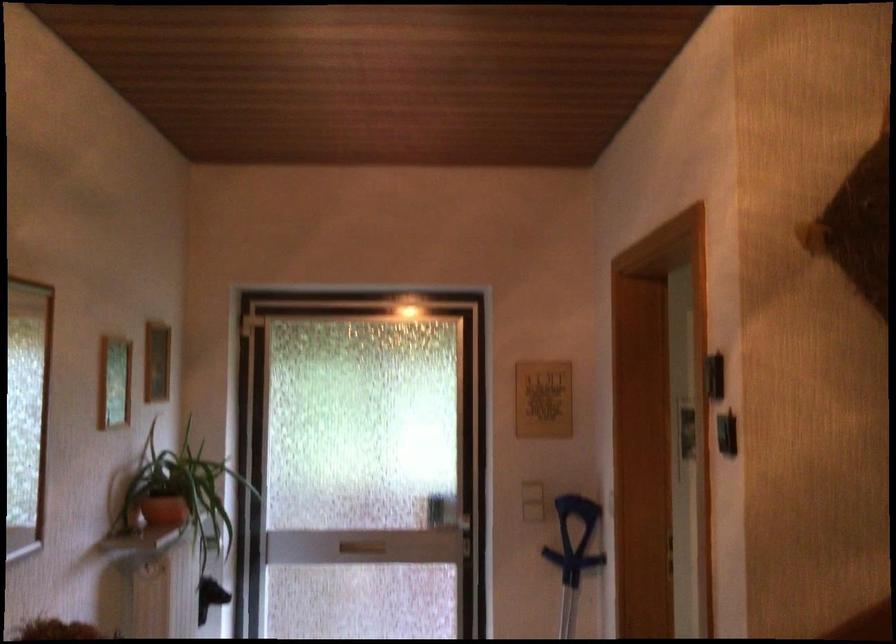
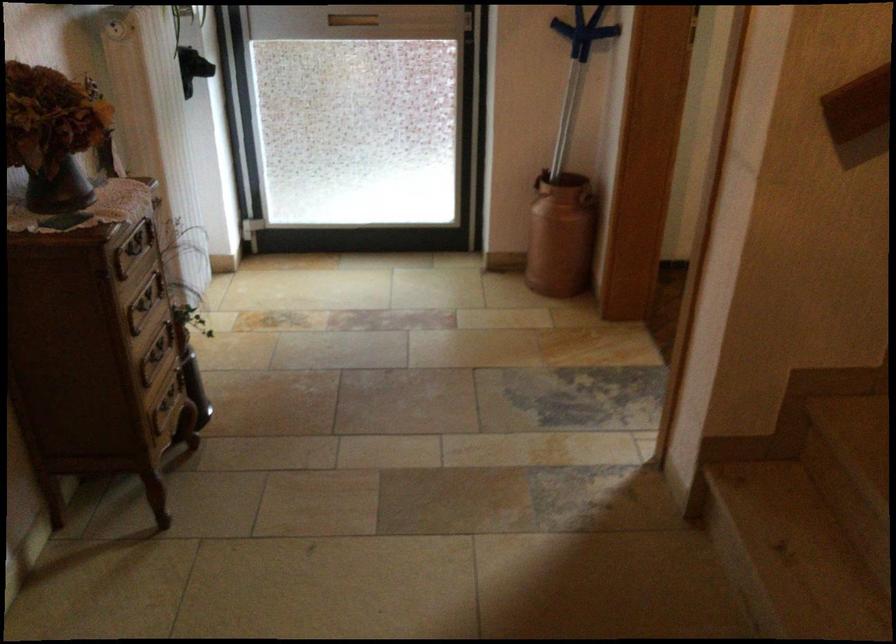
The point at [582,560] is marked in the first image. Where is the corresponding point in the second image?

(583, 31)